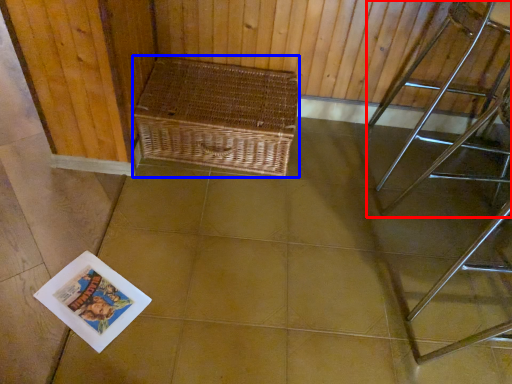
Question: Which object is closer to the camera taking this photo, furniture (highlighted by a red box) or picnic basket (highlighted by a blue box)?

Choices:
 (A) furniture
 (B) picnic basket

Answer: (A)